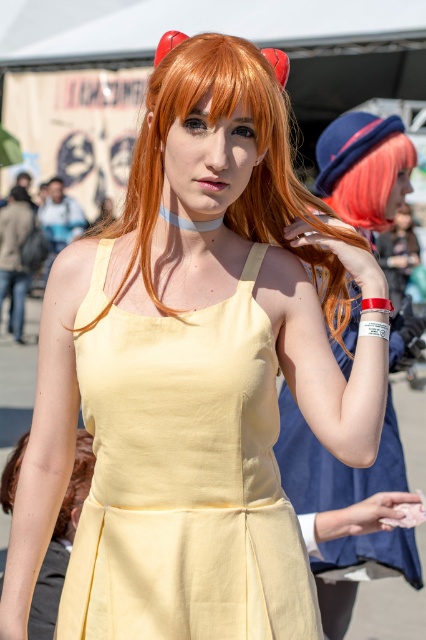
Question: Is yellow fabric dress at center closer to the viewer compared to matte yellow dress at center?

Choices:
 (A) no
 (B) yes

Answer: (B)

Question: Which is nearer to the matte yellow dress at center?

Choices:
 (A) yellow fabric dress at center
 (B) linen yellow dress at center
 (C) shiny pink wig at upper right
 (D) shiny orange hair at center

Answer: (B)

Question: Can you confirm if shiny orange hair at center is bigger than shiny pink wig at upper right?

Choices:
 (A) no
 (B) yes

Answer: (B)

Question: Among these objects, which one is farthest from the camera?

Choices:
 (A) linen yellow dress at center
 (B) matte yellow dress at center
 (C) shiny orange hair at center
 (D) yellow fabric dress at center

Answer: (B)

Question: Is yellow fabric dress at center thinner than shiny pink wig at upper right?

Choices:
 (A) yes
 (B) no

Answer: (B)

Question: Which object is closer to the camera taking this photo?

Choices:
 (A) yellow fabric dress at center
 (B) matte yellow dress at center
 (C) linen yellow dress at center
 (D) shiny pink wig at upper right

Answer: (C)